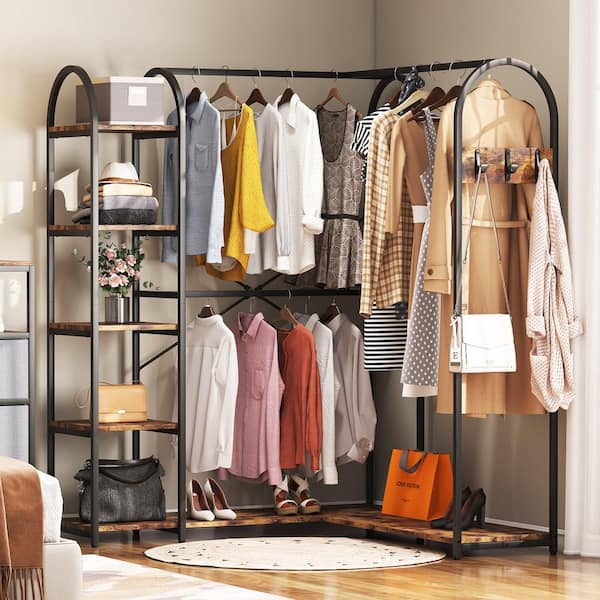
Identify the location of shelf. The width and height of the screenshot is (600, 600). (153, 523), (130, 427), (135, 324), (144, 225), (148, 129).